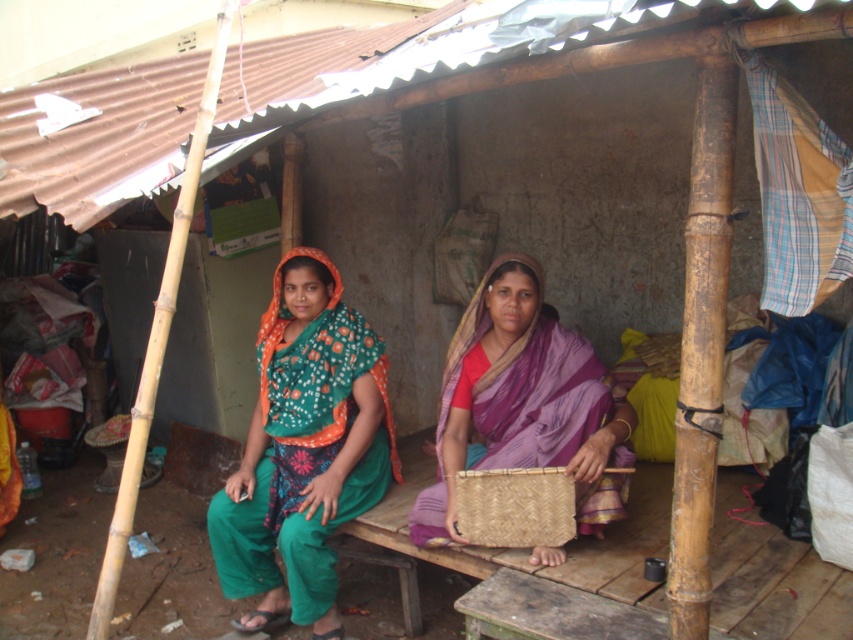
You are a photographer trying to capture the two women in the center of the image. Since both the green printed saree at center and the woven straw basket at center are in your view, which one is located to the left?

The green printed saree at center is positioned on the left side of the woven straw basket at center, so the green printed saree at center is located to the left.

You are standing in front of the shelter and see the point at coordinates (305, 449). Which object is this point located on?

The point at coordinates (305, 449) is located on the green printed saree at center.

You are trying to decide which basket to place a gift in. The purple woven basket at center and the woven straw basket at center are both available. Which basket is located to the right of the other?

The purple woven basket at center is positioned on the right side of the woven straw basket at center.